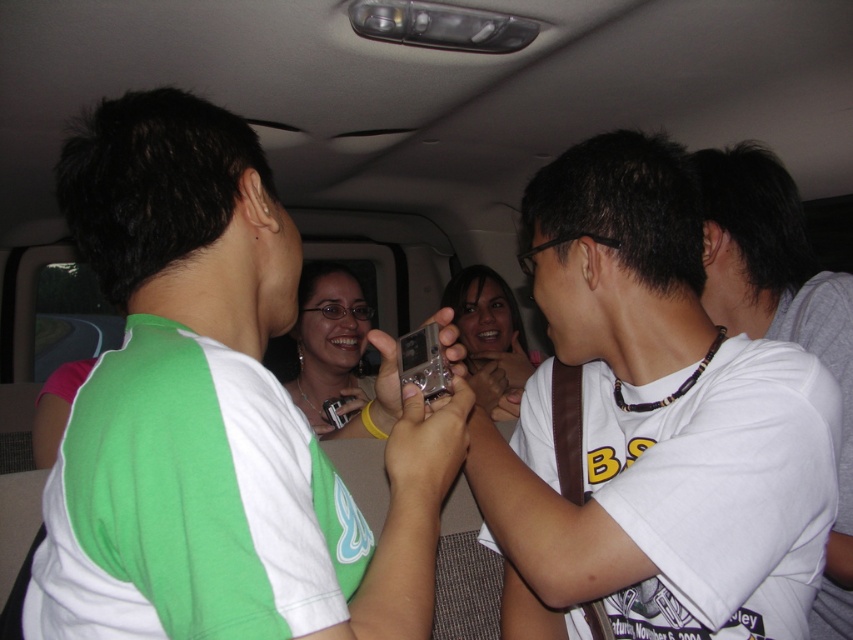
Question: Considering the relative positions of green fabric shirt at center and matte silver phone at center in the image provided, where is green fabric shirt at center located with respect to matte silver phone at center?

Choices:
 (A) above
 (B) below

Answer: (A)

Question: Is white matte shirt at upper right in front of matte silver phone at center?

Choices:
 (A) no
 (B) yes

Answer: (A)

Question: Which of the following is the closest to the observer?

Choices:
 (A) (294, 400)
 (B) (144, 451)
 (C) (496, 321)
 (D) (595, 141)

Answer: (B)

Question: Estimate the real-world distances between objects in this image. Which object is closer to the matte silver phone at center?

Choices:
 (A) white matte shirt at center
 (B) matte silver camera at center

Answer: (A)

Question: Which point appears closest to the camera in this image?

Choices:
 (A) (558, 500)
 (B) (291, 369)
 (C) (834, 595)

Answer: (A)

Question: Observing the image, what is the correct spatial positioning of green fabric shirt at center in reference to matte silver phone at center?

Choices:
 (A) above
 (B) below

Answer: (A)